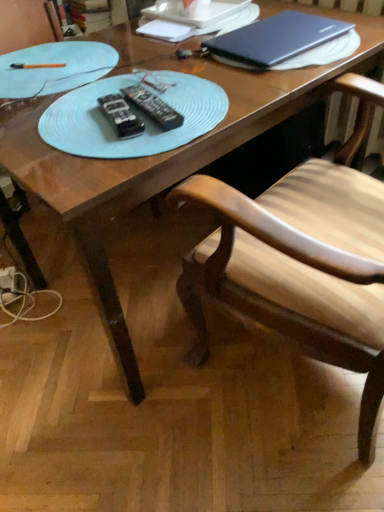
You are a GUI agent. You are given a task and a screenshot of the screen. Output one action in this format:
    pyautogui.click(x=<x>, y=<y>)
    Task: Click on the vacant space behind black plastic remote at center, the first remote in the right-to-left sequence
    The width and height of the screenshot is (384, 512).
    Given the screenshot: What is the action you would take?
    pyautogui.click(x=155, y=77)